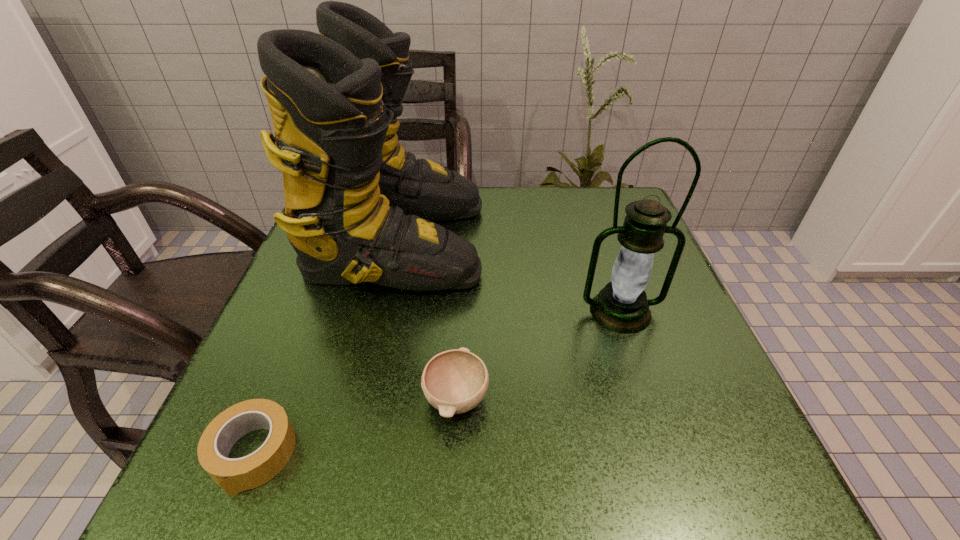
I want to click on free space between the duct tape and the tallest object, so click(x=325, y=348).

In order to click on unoccupied area between the ski boots and the duct tape in this screenshot , I will do `click(325, 348)`.

What are the coordinates of `empty space between the tallest object and the shortest object` in the screenshot? It's located at (325, 348).

Identify the location of empty location between the bowl and the duct tape. (354, 426).

Locate an element on the screen. free space between the second tallest object and the tallest object is located at coordinates (510, 276).

Image resolution: width=960 pixels, height=540 pixels. I want to click on vacant area that lies between the second shortest object and the duct tape, so click(354, 426).

At what (x,y) coordinates should I click in order to perform the action: click on vacant space that is in between the duct tape and the ski boots. Please return your answer as a coordinate pair (x, y). Looking at the image, I should click on (325, 348).

Where is `vacant area that lies between the second shortest object and the ski boots`? vacant area that lies between the second shortest object and the ski boots is located at coordinates (427, 320).

Image resolution: width=960 pixels, height=540 pixels. Find the location of `vacant space that is in between the ski boots and the lantern`. vacant space that is in between the ski boots and the lantern is located at coordinates (510, 276).

Locate an element on the screen. This screenshot has height=540, width=960. unoccupied position between the duct tape and the tallest object is located at coordinates tap(325, 348).